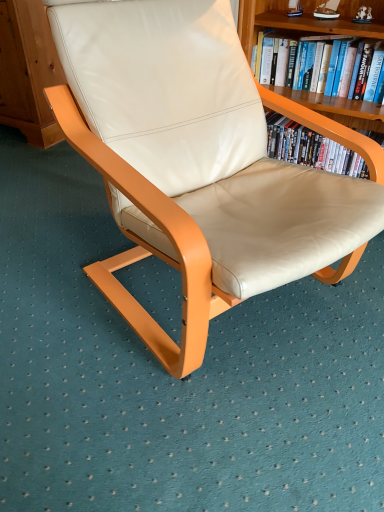
Question: Should I look upward or downward to see hardcover book at upper right?

Choices:
 (A) up
 (B) down

Answer: (A)

Question: From a real-world perspective, is wooden bookshelf at upper right physically above beige leather chair at center?

Choices:
 (A) no
 (B) yes

Answer: (B)

Question: Is wooden bookshelf at upper right far from beige leather chair at center?

Choices:
 (A) yes
 (B) no

Answer: (B)

Question: Considering the relative positions of wooden bookshelf at upper right and beige leather chair at center in the image provided, is wooden bookshelf at upper right to the right of beige leather chair at center from the viewer's perspective?

Choices:
 (A) yes
 (B) no

Answer: (A)

Question: Could beige leather chair at center be considered to be inside wooden bookshelf at upper right?

Choices:
 (A) yes
 (B) no

Answer: (B)

Question: Is wooden bookshelf at upper right facing away from beige leather chair at center?

Choices:
 (A) yes
 (B) no

Answer: (B)

Question: Does wooden bookshelf at upper right appear on the left side of beige leather chair at center?

Choices:
 (A) yes
 (B) no

Answer: (B)

Question: Is beige leather chair at center further to camera compared to wooden bookshelf at upper right?

Choices:
 (A) yes
 (B) no

Answer: (B)

Question: From the image's perspective, is beige leather chair at center located above wooden bookshelf at upper right?

Choices:
 (A) yes
 (B) no

Answer: (B)

Question: Does beige leather chair at center have a lesser height compared to wooden bookshelf at upper right?

Choices:
 (A) no
 (B) yes

Answer: (A)

Question: Considering the relative sizes of beige leather chair at center and wooden bookshelf at upper right in the image provided, is beige leather chair at center smaller than wooden bookshelf at upper right?

Choices:
 (A) no
 (B) yes

Answer: (A)

Question: From a real-world perspective, does beige leather chair at center sit lower than wooden bookshelf at upper right?

Choices:
 (A) yes
 (B) no

Answer: (A)

Question: From a real-world perspective, does beige leather chair at center stand above wooden bookshelf at upper right?

Choices:
 (A) no
 (B) yes

Answer: (A)

Question: Is beige leather chair at center outside hardcover book at upper right?

Choices:
 (A) yes
 (B) no

Answer: (A)